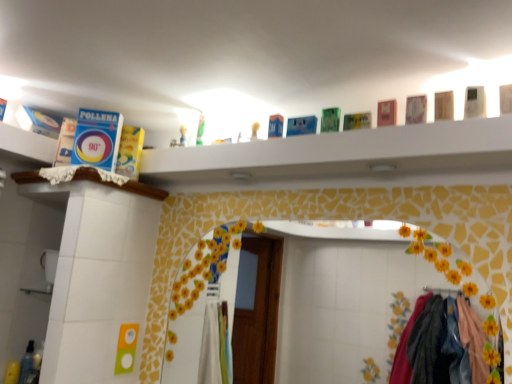
Question: Considering the relative sizes of wooden ledge at upper left, the 2th ledge viewed from the top, and blue cardboard box at upper center, arranged as the first ledge when viewed from the top, in the image provided, is wooden ledge at upper left, the 2th ledge viewed from the top, wider than blue cardboard box at upper center, arranged as the first ledge when viewed from the top,?

Choices:
 (A) no
 (B) yes

Answer: (B)

Question: From a real-world perspective, does wooden ledge at upper left, the 2th ledge viewed from the top, sit lower than blue cardboard box at upper center, arranged as the first ledge when viewed from the top?

Choices:
 (A) yes
 (B) no

Answer: (A)

Question: From a real-world perspective, does wooden ledge at upper left, marked as the 1th ledge in a bottom-to-top arrangement, stand above blue cardboard box at upper center, arranged as the first ledge when viewed from the top?

Choices:
 (A) yes
 (B) no

Answer: (B)

Question: Can you confirm if wooden ledge at upper left, the 2th ledge viewed from the top, is bigger than blue cardboard box at upper center, placed as the 2th ledge when sorted from bottom to top?

Choices:
 (A) no
 (B) yes

Answer: (A)

Question: From the image's perspective, is wooden ledge at upper left, marked as the 1th ledge in a bottom-to-top arrangement, located beneath blue cardboard box at upper center, placed as the 2th ledge when sorted from bottom to top?

Choices:
 (A) no
 (B) yes

Answer: (B)

Question: Choose the correct answer: Is translucent plastic bottle at lower left inside wooden ledge at upper left, the 2th ledge viewed from the top, or outside it?

Choices:
 (A) outside
 (B) inside

Answer: (A)

Question: Is translucent plastic bottle at lower left taller or shorter than wooden ledge at upper left, the 2th ledge viewed from the top?

Choices:
 (A) short
 (B) tall

Answer: (B)

Question: Looking at the image, does translucent plastic bottle at lower left seem bigger or smaller compared to wooden ledge at upper left, the 2th ledge viewed from the top?

Choices:
 (A) small
 (B) big

Answer: (A)

Question: Considering the positions of point (22, 377) and point (16, 183), is point (22, 377) closer or farther from the camera than point (16, 183)?

Choices:
 (A) closer
 (B) farther

Answer: (A)

Question: In the image, is blue cardboard box at upper center, arranged as the first ledge when viewed from the top, on the left side or the right side of translucent plastic bottle at lower left?

Choices:
 (A) left
 (B) right

Answer: (B)

Question: Is blue cardboard box at upper center, placed as the 2th ledge when sorted from bottom to top, wider or thinner than translucent plastic bottle at lower left?

Choices:
 (A) wide
 (B) thin

Answer: (A)

Question: Considering their positions, is blue cardboard box at upper center, placed as the 2th ledge when sorted from bottom to top, located in front of or behind translucent plastic bottle at lower left?

Choices:
 (A) behind
 (B) front

Answer: (B)

Question: Which is correct: blue cardboard box at upper center, placed as the 2th ledge when sorted from bottom to top, is inside translucent plastic bottle at lower left, or outside of it?

Choices:
 (A) inside
 (B) outside

Answer: (B)

Question: Is blue cardboard box at upper center, arranged as the first ledge when viewed from the top, wider or thinner than wooden ledge at upper left, the 2th ledge viewed from the top?

Choices:
 (A) wide
 (B) thin

Answer: (B)

Question: Is blue cardboard box at upper center, placed as the 2th ledge when sorted from bottom to top, bigger or smaller than wooden ledge at upper left, the 2th ledge viewed from the top?

Choices:
 (A) big
 (B) small

Answer: (A)